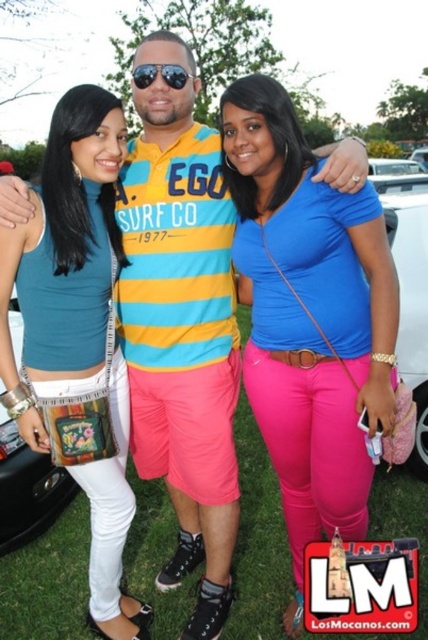
Question: Can you confirm if teal fabric tank top at center is positioned above sunglasses at center?

Choices:
 (A) yes
 (B) no

Answer: (B)

Question: Is teal fabric tank top at center below sunglasses at center?

Choices:
 (A) no
 (B) yes

Answer: (B)

Question: Does blue matte shirt at center appear under teal fabric tank top at center?

Choices:
 (A) no
 (B) yes

Answer: (A)

Question: Which of the following is the farthest from the observer?

Choices:
 (A) (148, 83)
 (B) (278, 132)

Answer: (A)

Question: Among these objects, which one is farthest from the camera?

Choices:
 (A) teal fabric tank top at center
 (B) blue matte shirt at center
 (C) sunglasses at center

Answer: (C)

Question: Among these points, which one is farthest from the camera?

Choices:
 (A) (39, 449)
 (B) (181, 80)

Answer: (B)